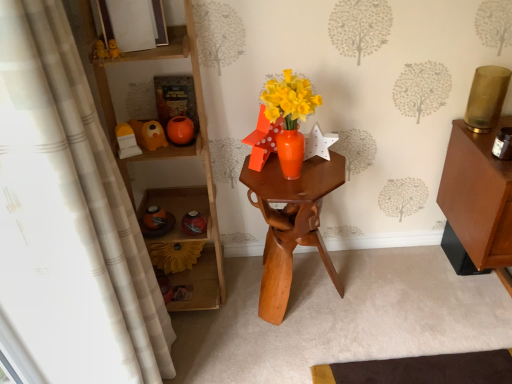
Question: From the image's perspective, does wooden hexagonal table at center appear higher than white textured curtain at left?

Choices:
 (A) no
 (B) yes

Answer: (A)

Question: Considering the relative sizes of wooden hexagonal table at center and white textured curtain at left in the image provided, is wooden hexagonal table at center taller than white textured curtain at left?

Choices:
 (A) no
 (B) yes

Answer: (A)

Question: Is wooden hexagonal table at center not close to white textured curtain at left?

Choices:
 (A) yes
 (B) no

Answer: (B)

Question: From a real-world perspective, does wooden hexagonal table at center sit lower than white textured curtain at left?

Choices:
 (A) no
 (B) yes

Answer: (B)

Question: Could white textured curtain at left be considered to be inside wooden hexagonal table at center?

Choices:
 (A) no
 (B) yes

Answer: (A)

Question: Can you confirm if wooden hexagonal table at center is wider than white textured curtain at left?

Choices:
 (A) yes
 (B) no

Answer: (A)

Question: Is wooden shelf at left to the right of matte yellow plastic toy at left, positioned as the 1th toy in front-to-back order, from the viewer's perspective?

Choices:
 (A) yes
 (B) no

Answer: (A)

Question: Does wooden shelf at left turn towards matte yellow plastic toy at left, positioned as the 1th toy in front-to-back order?

Choices:
 (A) no
 (B) yes

Answer: (B)

Question: Is wooden shelf at left in contact with matte yellow plastic toy at left, positioned as the 1th toy in front-to-back order?

Choices:
 (A) no
 (B) yes

Answer: (A)

Question: Are wooden shelf at left and matte yellow plastic toy at left, positioned as the 1th toy in front-to-back order, located far from each other?

Choices:
 (A) no
 (B) yes

Answer: (A)

Question: Does wooden shelf at left lie in front of matte yellow plastic toy at left, positioned as the 1th toy in front-to-back order?

Choices:
 (A) yes
 (B) no

Answer: (A)

Question: Is matte yellow plastic toy at left, positioned as the 1th toy in front-to-back order, located within wooden shelf at left?

Choices:
 (A) yes
 (B) no

Answer: (A)

Question: From a real-world perspective, is matte yellow plastic toy at left, positioned as the 1th toy in front-to-back order, located beneath matte white picture frame at upper center?

Choices:
 (A) no
 (B) yes

Answer: (B)